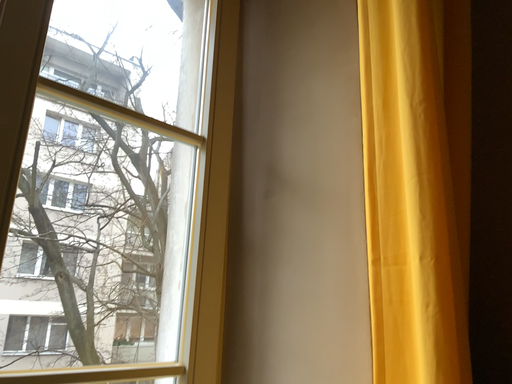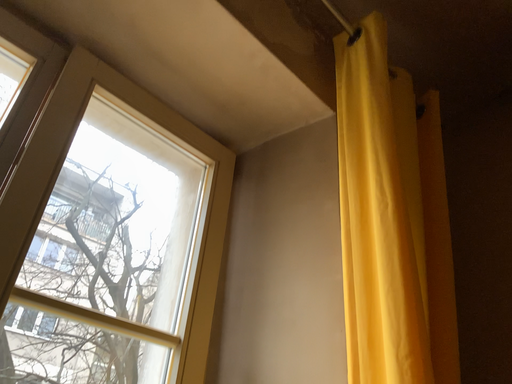
Question: Which way did the camera rotate in the video?

Choices:
 (A) rotated downward
 (B) rotated upward

Answer: (B)